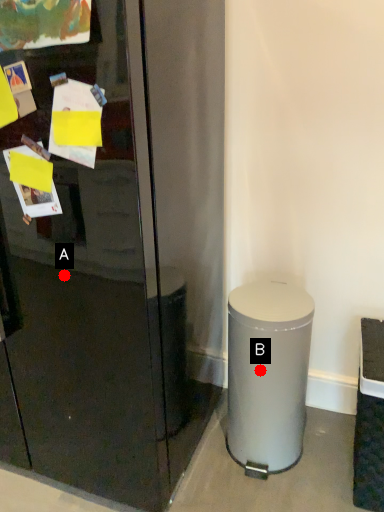
Question: Two points are circled on the image, labeled by A and B beside each circle. Among these points, which one is farthest from the camera?

Choices:
 (A) A is further
 (B) B is further

Answer: (B)